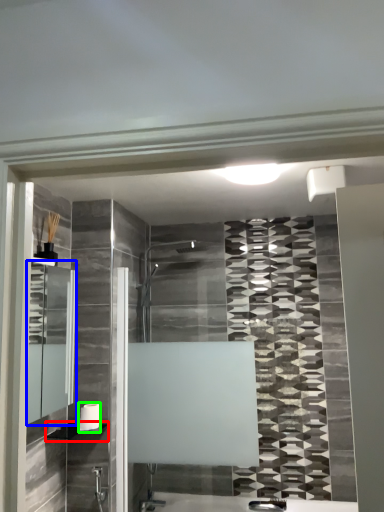
Question: Estimate the real-world distances between objects in this image. Which object is farther from shelf (highlighted by a red box), medicine cabinet (highlighted by a blue box) or towel bar (highlighted by a green box)?

Choices:
 (A) medicine cabinet
 (B) towel bar

Answer: (A)